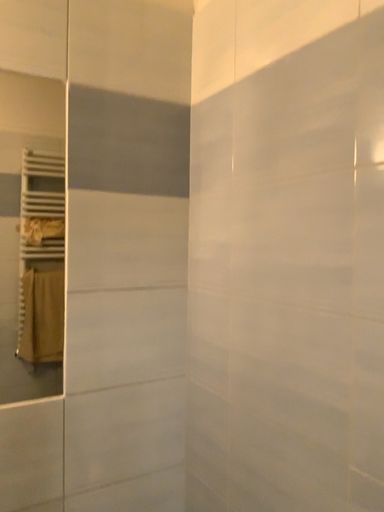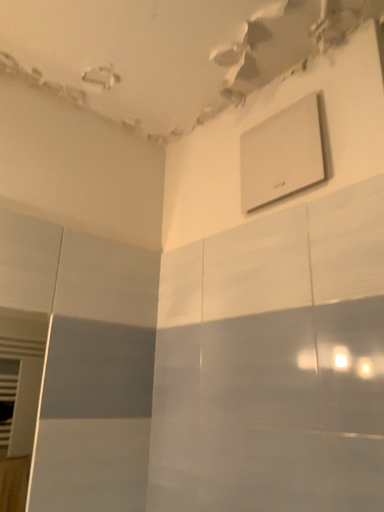
Question: Which way did the camera rotate in the video?

Choices:
 (A) rotated left
 (B) rotated right

Answer: (B)